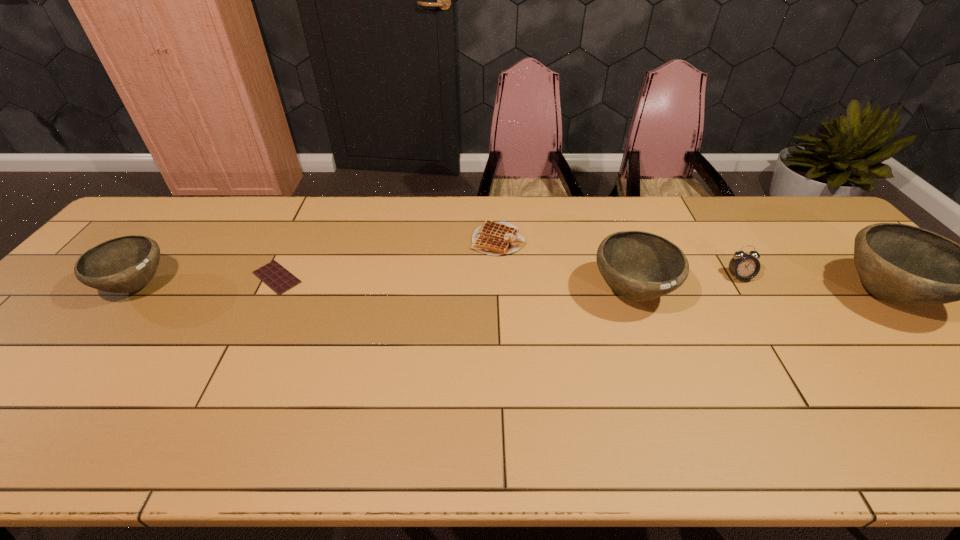
Locate which bowl is the third closest to the second object from left to right. Please provide its 2D coordinates. Your answer should be formatted as a tuple, i.e. [(x, y)], where the tuple contains the x and y coordinates of a point satisfying the conditions above.

[(901, 264)]

Identify the location of the second closest bowl to the second tallest object. Image resolution: width=960 pixels, height=540 pixels. (125, 264).

Find the location of a particular element. Image resolution: width=960 pixels, height=540 pixels. vacant space that satisfies the following two spatial constraints: 1. on the front side of the farthest object; 2. on the right side of the second shortest bowl is located at coordinates (500, 293).